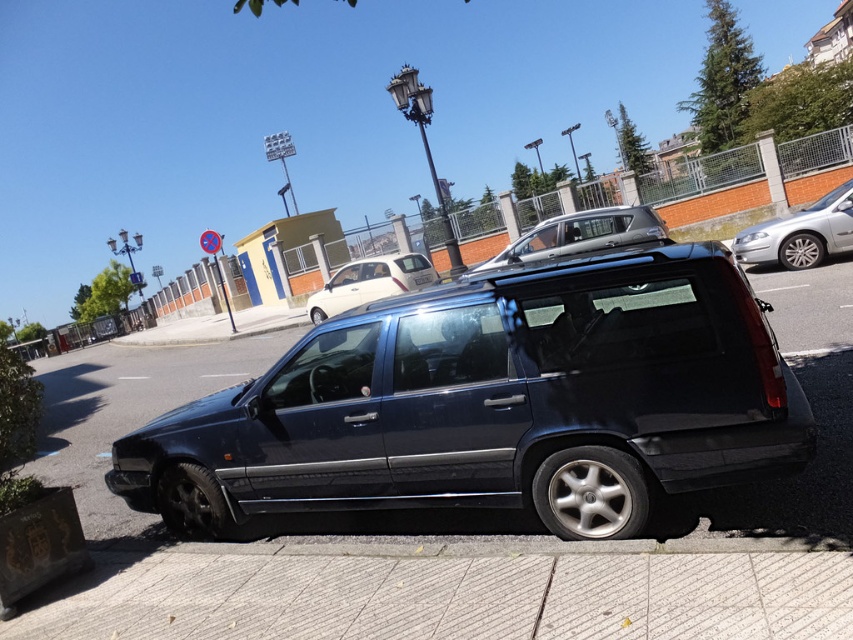
You are a delivery person trying to park your 1.8 meters tall delivery box between the silver metallic sedan at right and the satin black suv at center. Can the delivery box fit vertically between them?

The silver metallic sedan at right is taller than the satin black suv at center. Since the delivery box is 1.8 meters tall, it can only fit if the space between them is at least that height. However, since the sedan is taller, the lowest point between them would be determined by the suv. If the suv is shorter than 1.8 meters, the box might not fit. The description only states the sedan is taller, but doesn

You are a pedestrian standing on the sidewalk and want to cross the street to reach the grassy area behind the decorative stone planter. The silver metallic sedan at right and the satin black suv at center are parked on the road. Which vehicle should you avoid walking in front of if you want to stay as far as possible from the road traffic?

You should avoid walking in front of the silver metallic sedan at right because it is positioned to the right of the satin black suv at center, placing it closer to the sidewalk where you are standing. This means the silver metallic sedan at right is nearer to you, so staying away from it keeps you farther from traffic.